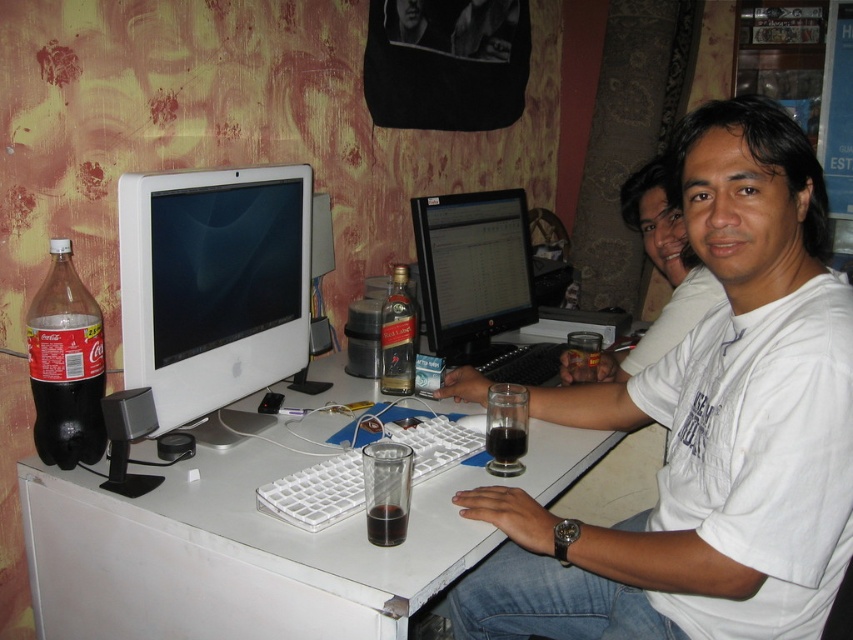
Who is more distant from viewer, (70, 289) or (401, 324)?

The point (401, 324) is more distant.

Who is more forward, (80,365) or (397,369)?

Point (80,365) is more forward.

This screenshot has height=640, width=853. What do you see at coordinates (65, 364) in the screenshot?
I see `translucent plastic coca-cola bottle at left` at bounding box center [65, 364].

The image size is (853, 640). In order to click on translucent plastic coca-cola bottle at left in this screenshot , I will do `click(65, 364)`.

Between white glossy computer monitor at center and translucent glass cup at desk center, which one appears on the right side from the viewer's perspective?

Positioned to the right is translucent glass cup at desk center.

At what (x,y) coordinates should I click in order to perform the action: click on white glossy computer monitor at center. Please return your answer as a coordinate pair (x, y). The height and width of the screenshot is (640, 853). Looking at the image, I should click on click(x=213, y=291).

This screenshot has height=640, width=853. What are the coordinates of `white glossy computer monitor at center` in the screenshot? It's located at (213, 291).

Which is in front, point (202, 314) or point (102, 378)?

Point (102, 378) is in front.

Which of these two, white glossy computer monitor at center or translucent plastic coca-cola bottle at left, stands shorter?

translucent plastic coca-cola bottle at left is shorter.

Identify the location of white glossy computer monitor at center. (213, 291).

I want to click on white glossy computer monitor at center, so click(213, 291).